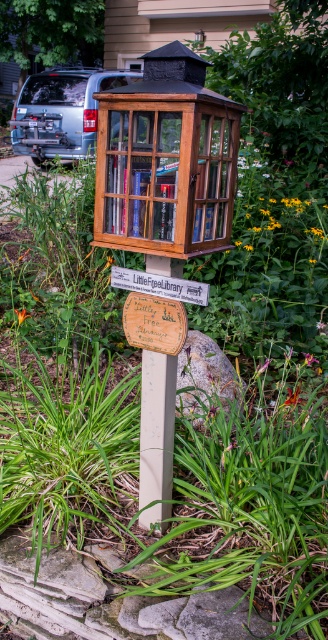
Who is taller, orange petal at center or orange matte flower at center?

Standing taller between the two is orange matte flower at center.

Does orange petal at center have a lesser width compared to orange matte flower at center?

Incorrect, orange petal at center's width is not less than orange matte flower at center's.

This screenshot has width=328, height=640. What are the coordinates of `orange petal at center` in the screenshot? It's located at (292, 396).

The height and width of the screenshot is (640, 328). I want to click on orange petal at center, so click(292, 396).

Is point (262, 364) positioned in front of point (247, 250)?

Yes, point (262, 364) is closer to viewer.

Can you confirm if purple matte flower at center is positioned to the right of yellow textured flower at center?

Incorrect, purple matte flower at center is not on the right side of yellow textured flower at center.

The height and width of the screenshot is (640, 328). Describe the element at coordinates (262, 365) in the screenshot. I see `purple matte flower at center` at that location.

This screenshot has width=328, height=640. I want to click on purple matte flower at center, so (x=262, y=365).

Is orange matte flower at center wider than yellow textured flower at center?

Correct, the width of orange matte flower at center exceeds that of yellow textured flower at center.

Who is lower down, orange matte flower at center or yellow textured flower at center?

Positioned lower is orange matte flower at center.

Where is `orange matte flower at center`? Image resolution: width=328 pixels, height=640 pixels. orange matte flower at center is located at coordinates (20, 314).

You are a GUI agent. You are given a task and a screenshot of the screen. Output one action in this format:
    pyautogui.click(x=<x>, y=<y>)
    Task: Click on the orange matte flower at center
    The width and height of the screenshot is (328, 640).
    Given the screenshot: What is the action you would take?
    pyautogui.click(x=20, y=314)